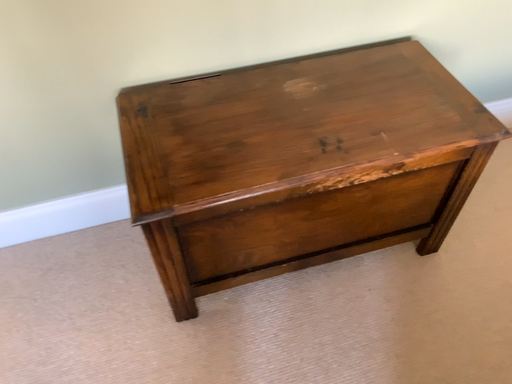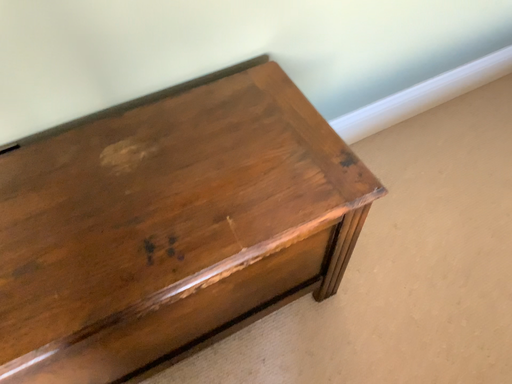
Question: How did the camera likely rotate when shooting the video?

Choices:
 (A) rotated right
 (B) rotated left

Answer: (A)